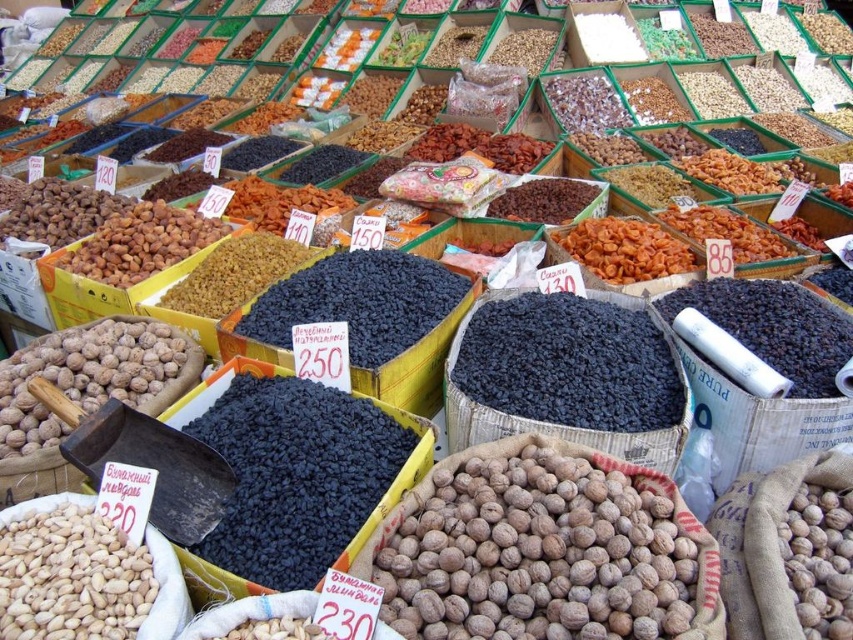
Does dark blue dried fruit at center appear on the right side of brown matte nuts at center?

Correct, you'll find dark blue dried fruit at center to the right of brown matte nuts at center.

The height and width of the screenshot is (640, 853). Find the location of `dark blue dried fruit at center`. dark blue dried fruit at center is located at coordinates (569, 364).

Is brown rough walnut at lower left below dark matte raisins at center?

Yes, brown rough walnut at lower left is below dark matte raisins at center.

Between brown rough walnut at lower left and dark matte raisins at center, which one is positioned higher?

dark matte raisins at center is higher up.

Does point (434, 477) lie in front of point (225, 563)?

That is False.

Locate an element on the screen. The width and height of the screenshot is (853, 640). brown rough walnut at lower left is located at coordinates pos(534,550).

Is dark blue dried fruit at center to the left of white matte nuts at lower left from the viewer's perspective?

Incorrect, dark blue dried fruit at center is not on the left side of white matte nuts at lower left.

Can you confirm if dark blue dried fruit at center is taller than white matte nuts at lower left?

Correct, dark blue dried fruit at center is much taller as white matte nuts at lower left.

I want to click on dark blue dried fruit at center, so click(569, 364).

Find the location of `dark blue dried fruit at center`. dark blue dried fruit at center is located at coordinates (569, 364).